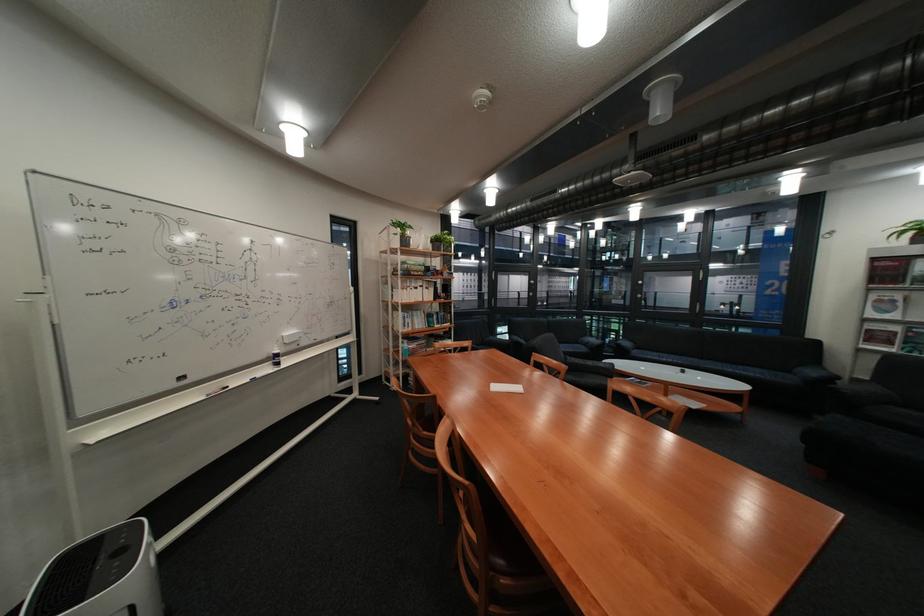
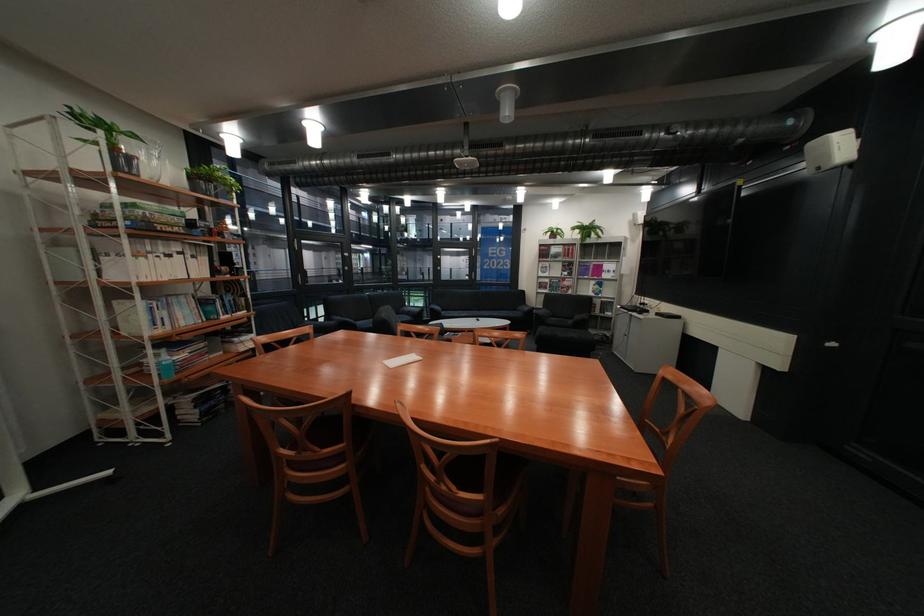
In the second image, find the point that corresponds to pixel 436 429 in the first image.

(333, 450)